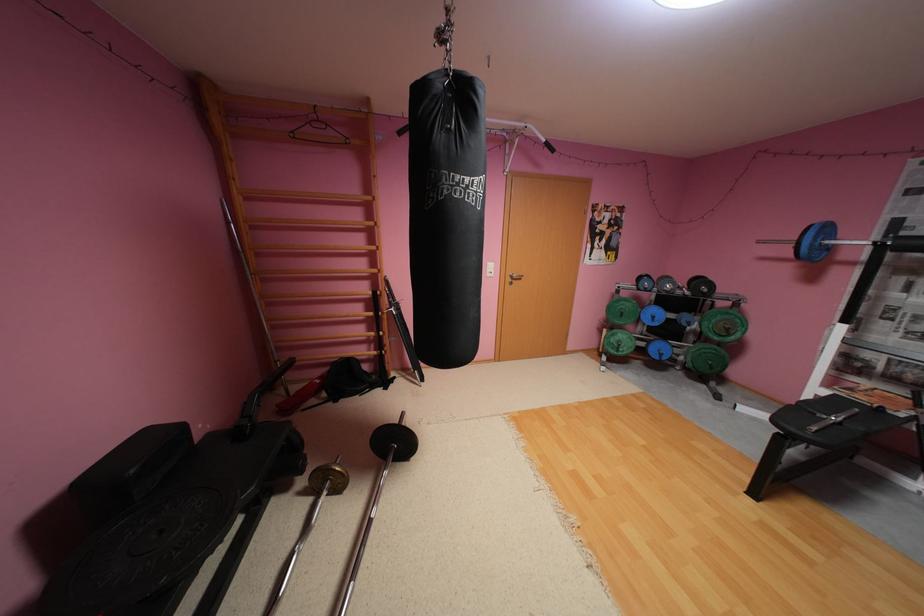
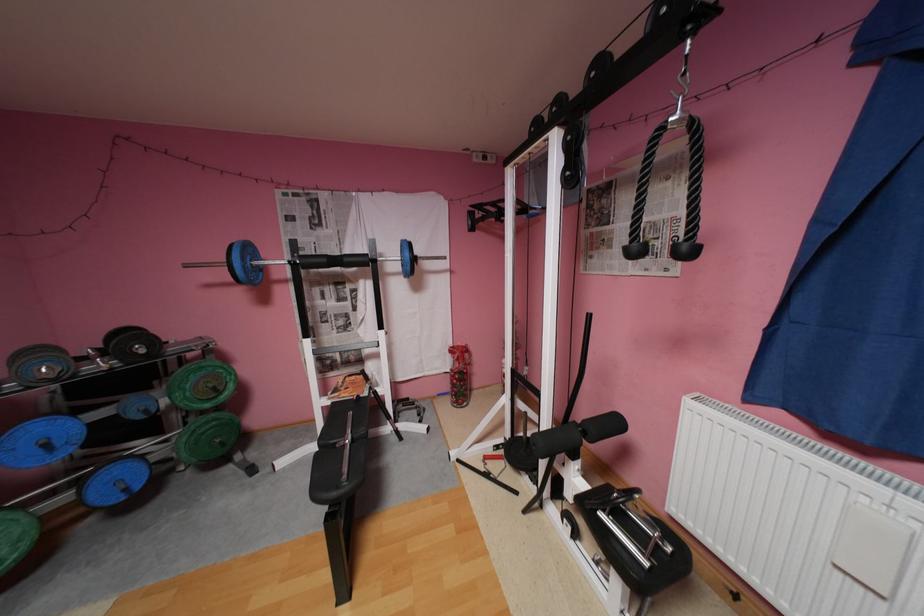
The point at (675, 278) is marked in the first image. Where is the corresponding point in the second image?

(49, 351)